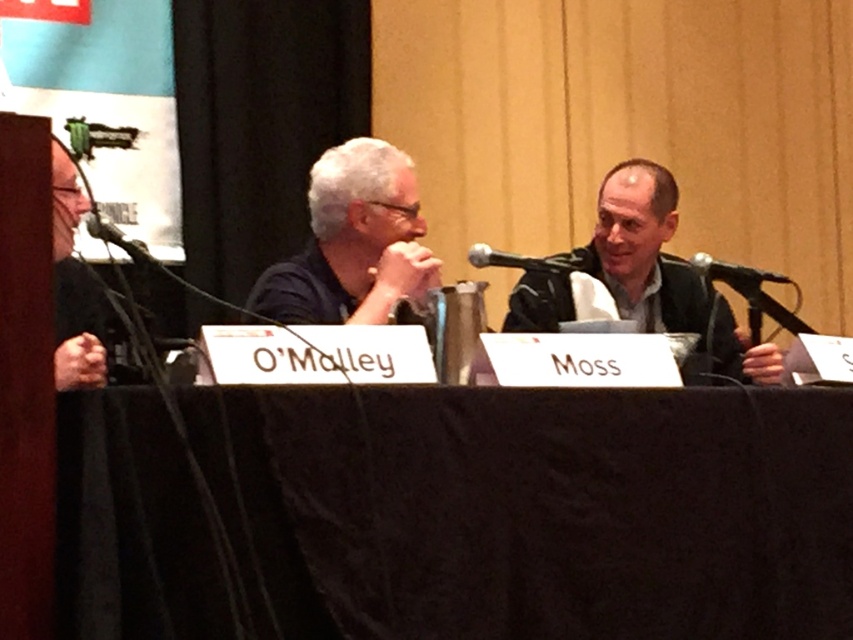
Question: Can you confirm if matte black jacket at center is positioned above black metallic microphone at center?

Choices:
 (A) no
 (B) yes

Answer: (A)

Question: Which point appears closest to the camera in this image?

Choices:
 (A) (517, 397)
 (B) (660, 272)
 (C) (136, 241)

Answer: (A)

Question: Among these objects, which one is farthest from the camera?

Choices:
 (A) dark blue shirt at center
 (B) black fabric table at center
 (C) matte black jacket at center

Answer: (C)

Question: Which of these objects is positioned closest to the matte black jacket at center?

Choices:
 (A) black matte microphone at left
 (B) black plastic microphone at center
 (C) black metallic microphone at center

Answer: (B)

Question: Does black fabric table at center have a greater width compared to black matte microphone at left?

Choices:
 (A) yes
 (B) no

Answer: (A)

Question: Is the position of black fabric table at center less distant than that of black plastic microphone at center?

Choices:
 (A) yes
 (B) no

Answer: (A)